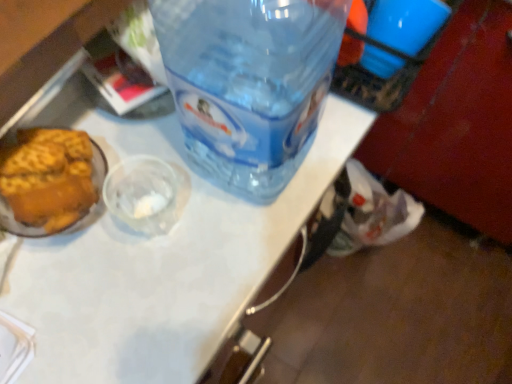
I want to click on free space in front of transparent plastic bottle at center, so click(x=195, y=273).